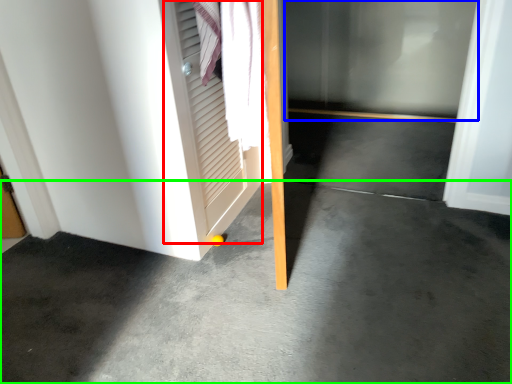
Question: Based on their relative distances, which object is farther from screen door (highlighted by a red box)? Choose from glass door (highlighted by a blue box) and concrete (highlighted by a green box).

Choices:
 (A) glass door
 (B) concrete

Answer: (A)